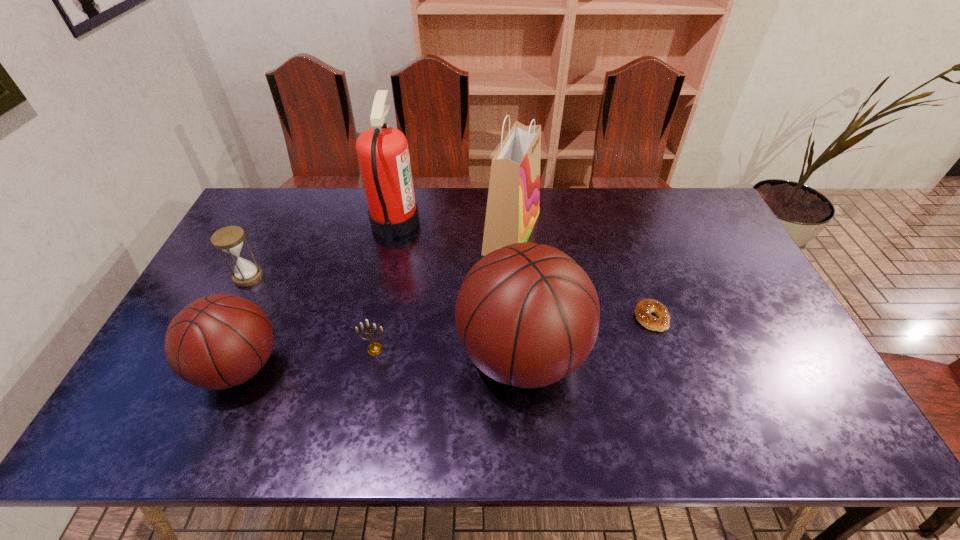
The width and height of the screenshot is (960, 540). Identify the location of vacant place for an extra basketball on the right. (792, 343).